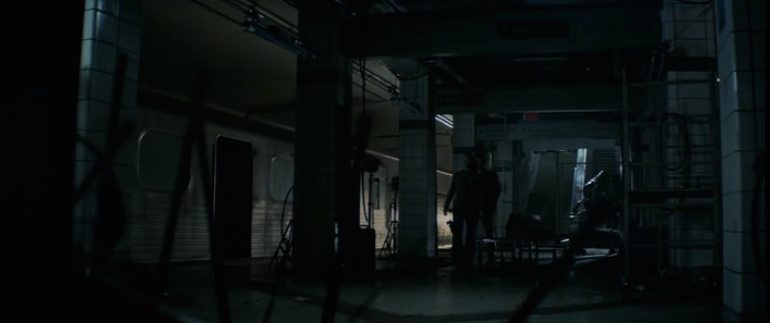
You are a GUI agent. You are given a task and a screenshot of the screen. Output one action in this format:
    pyautogui.click(x=<x>, y=<y>)
    Task: Click on the floor
    
    Given the screenshot: What is the action you would take?
    pyautogui.click(x=471, y=289)